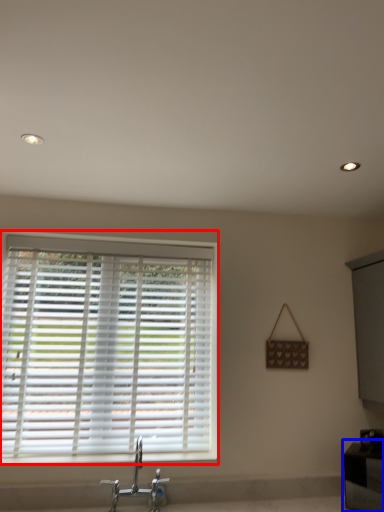
Question: Which object appears farthest to the camera in this image, window blind (highlighted by a red box) or vanity (highlighted by a blue box)?

Choices:
 (A) window blind
 (B) vanity

Answer: (A)